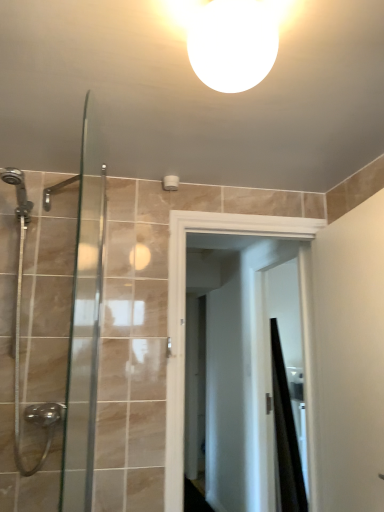
Question: Is white glossy light fixture at upper center surrounding clear glass shower door at left?

Choices:
 (A) no
 (B) yes

Answer: (A)

Question: Would you say white glossy light fixture at upper center is outside clear glass shower door at left?

Choices:
 (A) yes
 (B) no

Answer: (A)

Question: Is white glossy light fixture at upper center with clear glass shower door at left?

Choices:
 (A) no
 (B) yes

Answer: (A)

Question: Can you confirm if white glossy light fixture at upper center is positioned to the right of clear glass shower door at left?

Choices:
 (A) yes
 (B) no

Answer: (A)

Question: Is white glossy light fixture at upper center not close to clear glass shower door at left?

Choices:
 (A) yes
 (B) no

Answer: (A)

Question: Is white glossy light fixture at upper center looking in the opposite direction of clear glass shower door at left?

Choices:
 (A) yes
 (B) no

Answer: (B)

Question: Would you say black matte shower curtain at right is a long distance from clear glass shower door at left?

Choices:
 (A) yes
 (B) no

Answer: (A)

Question: Is black matte shower curtain at right surrounding clear glass shower door at left?

Choices:
 (A) yes
 (B) no

Answer: (B)

Question: Is the surface of black matte shower curtain at right in direct contact with clear glass shower door at left?

Choices:
 (A) yes
 (B) no

Answer: (B)

Question: Is black matte shower curtain at right bigger than clear glass shower door at left?

Choices:
 (A) yes
 (B) no

Answer: (A)

Question: Is black matte shower curtain at right taller than clear glass shower door at left?

Choices:
 (A) yes
 (B) no

Answer: (A)

Question: Is clear glass shower door at left at the back of black matte shower curtain at right?

Choices:
 (A) yes
 (B) no

Answer: (B)

Question: Is white glossy light fixture at upper center at the right side of matte white screen door at center?

Choices:
 (A) yes
 (B) no

Answer: (B)